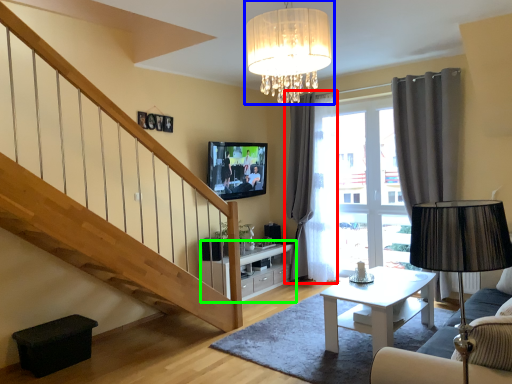
Question: Which object is positioned closest to curtain (highlighted by a red box)? Select from lamp (highlighted by a blue box) and cabinetry (highlighted by a green box).

Choices:
 (A) lamp
 (B) cabinetry

Answer: (B)